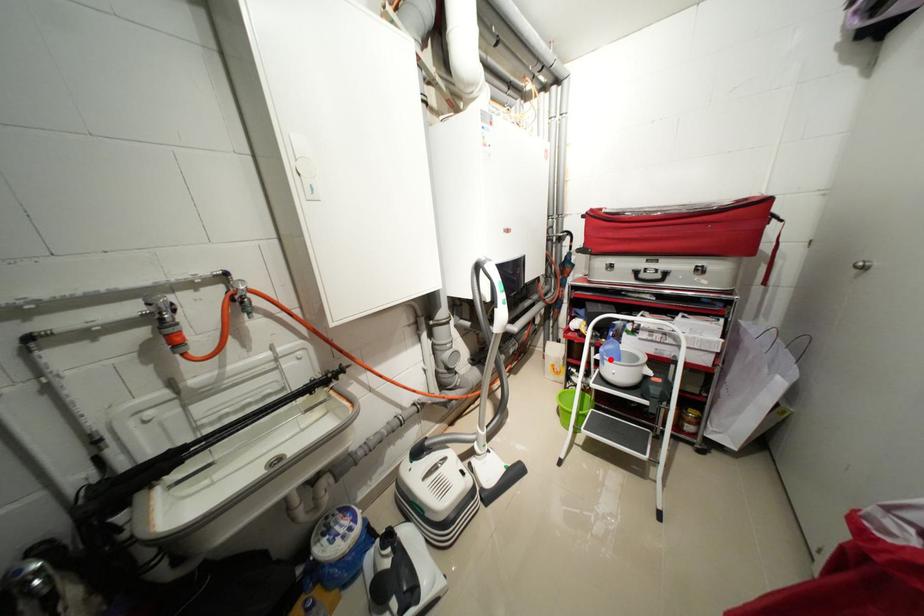
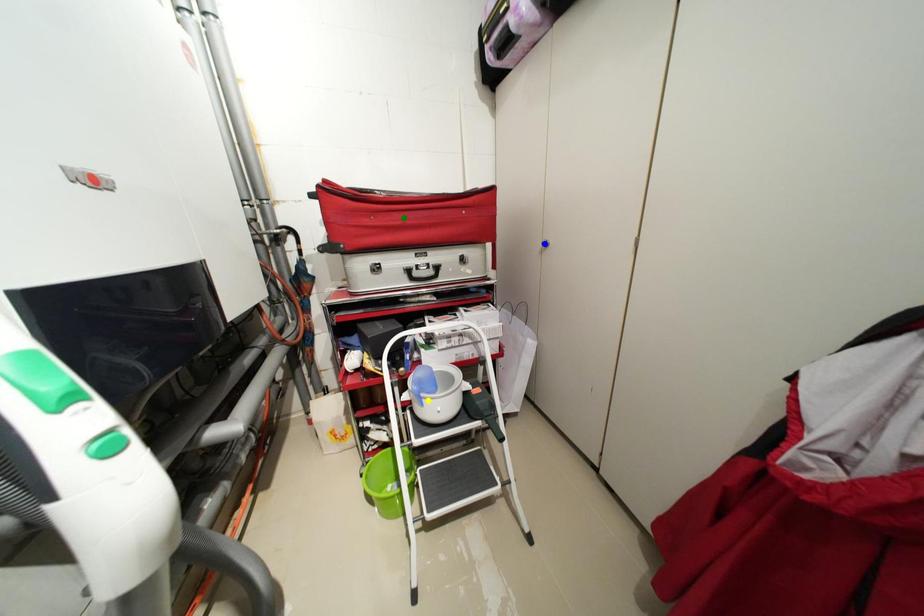
Question: I am providing you with two images of the same scene from different viewpoints. A red point is marked on the first image. You are given multiple points on the second image. In image 2, which mark is for the same physical point as the one in image 1?

Choices:
 (A) yellow point
 (B) blue point
 (C) green point

Answer: (A)